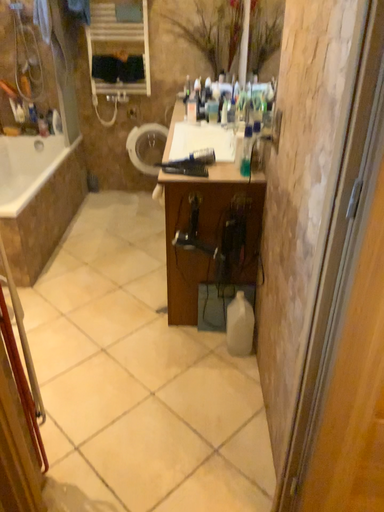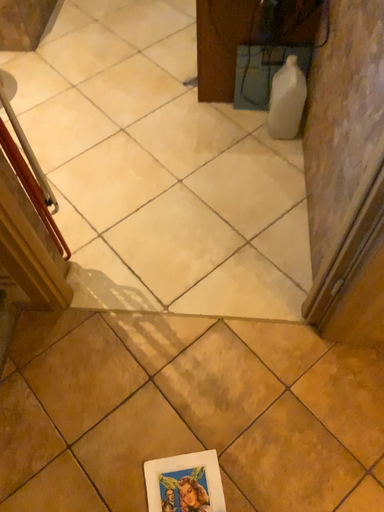
Question: Which way did the camera rotate in the video?

Choices:
 (A) rotated downward
 (B) rotated upward

Answer: (A)